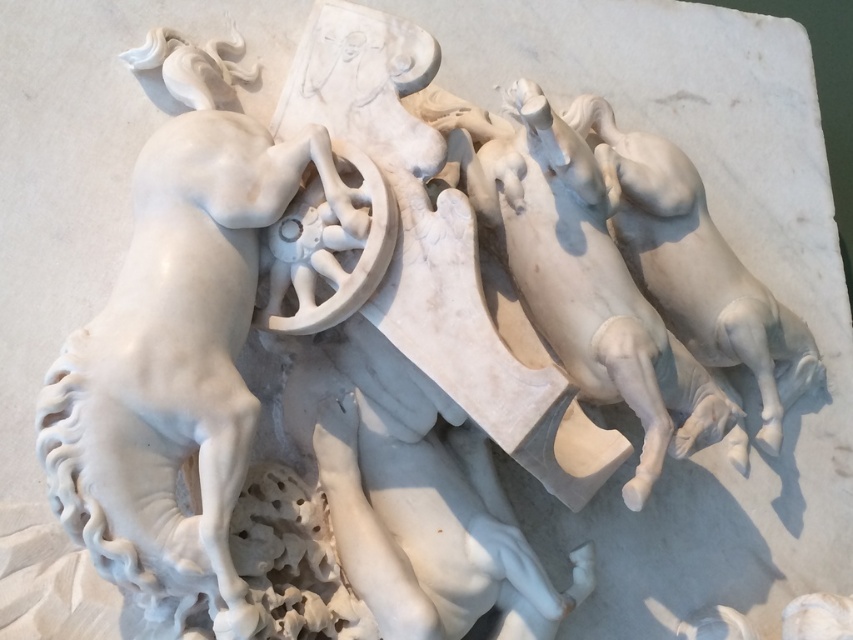
Does white marble horse at left appear on the right side of white marble horses at center?

Incorrect, white marble horse at left is not on the right side of white marble horses at center.

Between white marble horse at left and white marble horses at center, which one appears on the right side from the viewer's perspective?

Positioned to the right is white marble horses at center.

Who is more forward, (x=97, y=348) or (x=531, y=232)?

Point (x=97, y=348)

Locate an element on the screen. This screenshot has width=853, height=640. white marble horse at left is located at coordinates (177, 346).

How far apart are white marble horse at left and white marble horse at right?

The distance of white marble horse at left from white marble horse at right is 31.21 centimeters.

Is white marble horse at left to the left of white marble horse at right from the viewer's perspective?

Indeed, white marble horse at left is positioned on the left side of white marble horse at right.

Image resolution: width=853 pixels, height=640 pixels. Find the location of `white marble horse at left`. white marble horse at left is located at coordinates (177, 346).

Where is `white marble horse at left`? The width and height of the screenshot is (853, 640). white marble horse at left is located at coordinates (177, 346).

Does white marble horses at center have a smaller size compared to white marble horse at right?

No.

This screenshot has height=640, width=853. Describe the element at coordinates (584, 282) in the screenshot. I see `white marble horses at center` at that location.

I want to click on white marble horses at center, so click(584, 282).